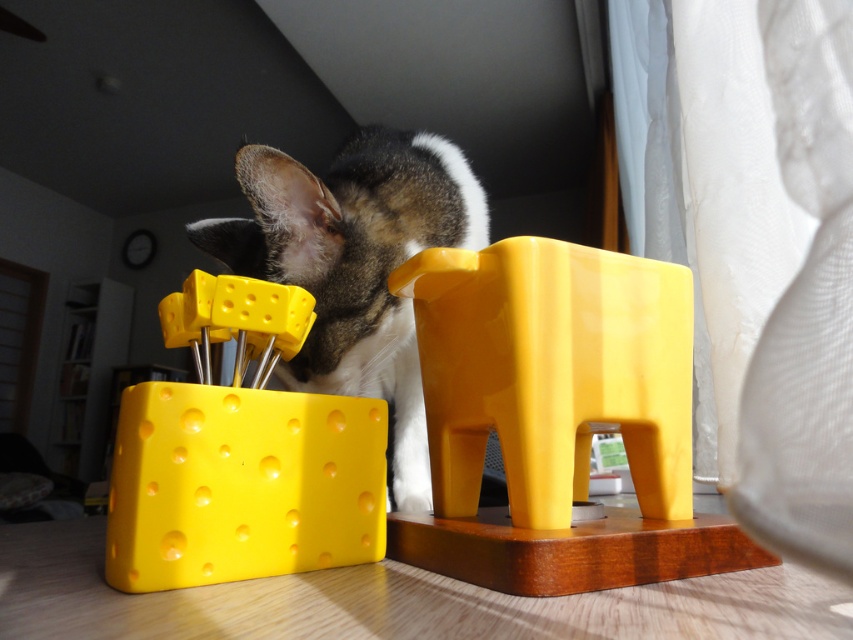
You are a child who wants to place a new toy on the wooden table. The yellow plastic elephant at center is already occupying a spot at point (556, 417). Can you place your toy here without moving the elephant?

The yellow plastic elephant at center is already at point (556, 417), so you cannot place your toy there without moving it.

You are a cat owner trying to decide where to place a new toy for your cat. You have two options on the desk shown in the image. The first option is to place the toy near the matte plastic cheese at left, and the second is near the fluffy fur cat at center. Based on the sizes of the objects, which location would provide more space for the new toy?

The fluffy fur cat at center is larger than the matte plastic cheese at left. Therefore, placing the new toy near the matte plastic cheese at left would leave more space available for the toy.

You are an interior designer planning to place a new lamp on the desk. The lamp has a base that requires a clear space of 10 cm in diameter. Given the current desk layout with the yellow plastic elephant at center, can you place the lamp base anywhere on the desk without overlapping the elephant?

The yellow plastic elephant at center is located at point (556,417). Since the desk has other items like the pencil holder and cow toy, but the question only mentions the elephant, the lamp can be placed elsewhere on the desk as long as it avoids the elephant and maintains the required 10 cm clearance around it.